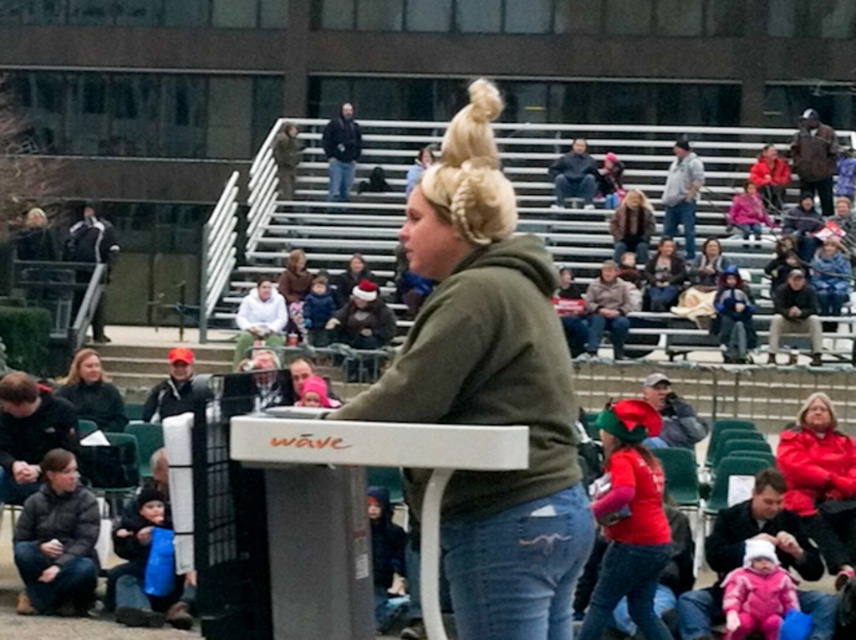
Is blue denim jeans at center shorter than blue denim jeans at upper center?

In fact, blue denim jeans at center may be taller than blue denim jeans at upper center.

Who is shorter, blue denim jeans at center or blue denim jeans at upper center?

blue denim jeans at upper center

Between point (687, 212) and point (330, 161), which one is positioned behind?

The point (330, 161) is behind.

This screenshot has width=856, height=640. In order to click on blue denim jeans at center in this screenshot , I will do `click(681, 221)`.

Between green matte hoodie at center and jeans at lower right, which one is positioned lower?

jeans at lower right is below.

Does green matte hoodie at center have a greater width compared to jeans at lower right?

Yes, green matte hoodie at center is wider than jeans at lower right.

Who is more forward, (462, 262) or (817, 628)?

Point (462, 262) is in front.

The height and width of the screenshot is (640, 856). What are the coordinates of `green matte hoodie at center` in the screenshot? It's located at (489, 388).

Between dark gray hoodie at upper center and blue denim jeans at center, which one has more height?

With more height is dark gray hoodie at upper center.

How distant is dark gray hoodie at upper center from blue denim jeans at center?

dark gray hoodie at upper center is 4.91 feet away from blue denim jeans at center.

Measure the distance between dark gray hoodie at upper center and camera.

dark gray hoodie at upper center and camera are 33.01 meters apart from each other.

Find the location of `dark gray hoodie at upper center`. dark gray hoodie at upper center is located at coordinates (574, 173).